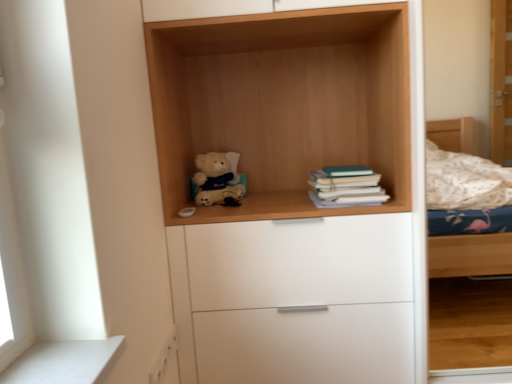
Question: Considering the relative sizes of white matte chest of drawers at center and light wood/texture teddy bear at center in the image provided, is white matte chest of drawers at center smaller than light wood/texture teddy bear at center?

Choices:
 (A) no
 (B) yes

Answer: (A)

Question: Considering the relative positions of white matte chest of drawers at center and light wood/texture teddy bear at center in the image provided, is white matte chest of drawers at center in front of light wood/texture teddy bear at center?

Choices:
 (A) yes
 (B) no

Answer: (B)

Question: Is white matte chest of drawers at center far away from light wood/texture teddy bear at center?

Choices:
 (A) no
 (B) yes

Answer: (A)

Question: Is white matte chest of drawers at center to the left of light wood/texture teddy bear at center from the viewer's perspective?

Choices:
 (A) yes
 (B) no

Answer: (B)

Question: Can we say white matte chest of drawers at center lies outside light wood/texture teddy bear at center?

Choices:
 (A) no
 (B) yes

Answer: (B)

Question: Is white matte drawer at lower left inside or outside of light wood/texture teddy bear at center?

Choices:
 (A) inside
 (B) outside

Answer: (B)

Question: Considering the positions of white matte drawer at lower left and light wood/texture teddy bear at center in the image, is white matte drawer at lower left taller or shorter than light wood/texture teddy bear at center?

Choices:
 (A) tall
 (B) short

Answer: (B)

Question: In terms of width, does white matte drawer at lower left look wider or thinner when compared to light wood/texture teddy bear at center?

Choices:
 (A) wide
 (B) thin

Answer: (B)

Question: From a real-world perspective, is white matte drawer at lower left positioned above or below light wood/texture teddy bear at center?

Choices:
 (A) below
 (B) above

Answer: (A)

Question: Considering their positions, is teal matte book at center right located in front of or behind white matte chest of drawers at center?

Choices:
 (A) front
 (B) behind

Answer: (B)

Question: From a real-world perspective, is teal matte book at center right physically located above or below white matte chest of drawers at center?

Choices:
 (A) above
 (B) below

Answer: (A)

Question: Does point (317, 192) appear closer or farther from the camera than point (197, 276)?

Choices:
 (A) closer
 (B) farther

Answer: (B)

Question: In terms of width, does teal matte book at center right look wider or thinner when compared to white matte chest of drawers at center?

Choices:
 (A) wide
 (B) thin

Answer: (B)

Question: Considering their positions, is light wood/texture teddy bear at center located in front of or behind soft plush teddy bear at center?

Choices:
 (A) behind
 (B) front

Answer: (B)

Question: In terms of size, does light wood/texture teddy bear at center appear bigger or smaller than soft plush teddy bear at center?

Choices:
 (A) big
 (B) small

Answer: (A)